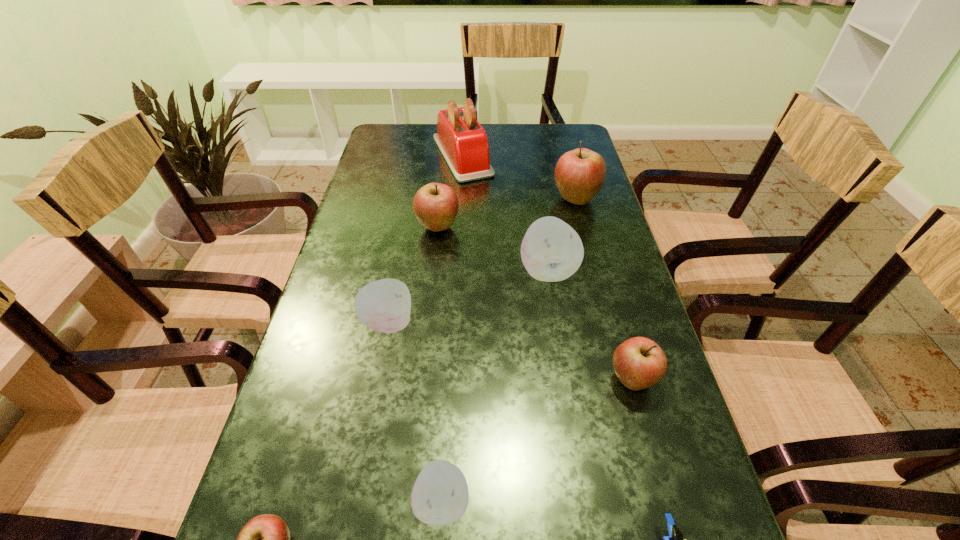
Image resolution: width=960 pixels, height=540 pixels. I want to click on the smallest white apple, so click(x=440, y=495).

Where is `the nearest white apple`? This screenshot has width=960, height=540. the nearest white apple is located at coordinates (440, 495).

Find the location of `vacant area situated 0.120m on the front of the toaster`. vacant area situated 0.120m on the front of the toaster is located at coordinates (460, 207).

Find the location of a particular element. vacant point located 0.100m on the back of the biggest red apple is located at coordinates (567, 168).

This screenshot has height=540, width=960. Identify the location of vacant point located on the right of the second red apple from left to right. (586, 227).

You are a GUI agent. You are given a task and a screenshot of the screen. Output one action in this format:
    pyautogui.click(x=<x>, y=<y>)
    Task: Click on the blank space located on the left of the farthest white apple
    The width and height of the screenshot is (960, 540).
    Given the screenshot: What is the action you would take?
    pyautogui.click(x=422, y=271)

I want to click on vacant space located 0.170m on the front of the leftmost white apple, so click(370, 418).

The image size is (960, 540). Find the location of `free point located on the back of the fourth nearest object`. free point located on the back of the fourth nearest object is located at coordinates (597, 256).

What are the coordinates of `vacant area located 0.240m on the left of the smallest white apple` in the screenshot? It's located at (267, 502).

Identify the location of object located at the far edge. The height and width of the screenshot is (540, 960). tap(463, 142).